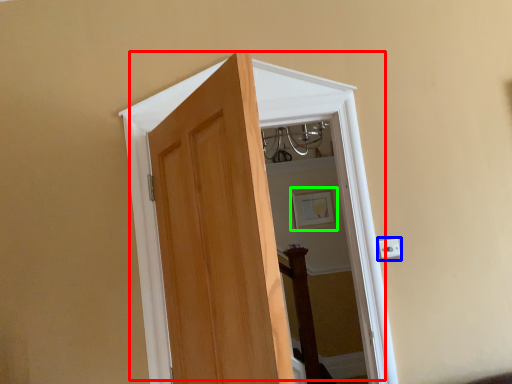
Question: Which is farther away from door (highlighted by a red box)? electric outlet (highlighted by a blue box) or picture frame (highlighted by a green box)?

Choices:
 (A) electric outlet
 (B) picture frame

Answer: (B)